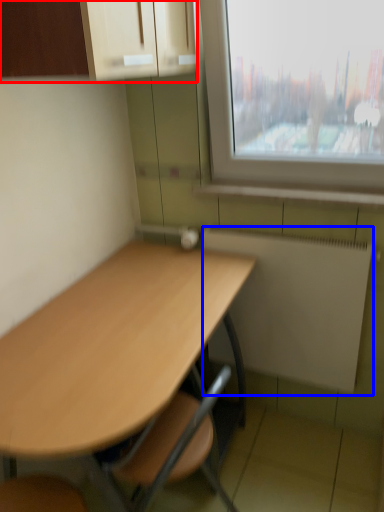
Question: Which point is further to the camera, cabinetry (highlighted by a red box) or radiator (highlighted by a blue box)?

Choices:
 (A) cabinetry
 (B) radiator

Answer: (B)